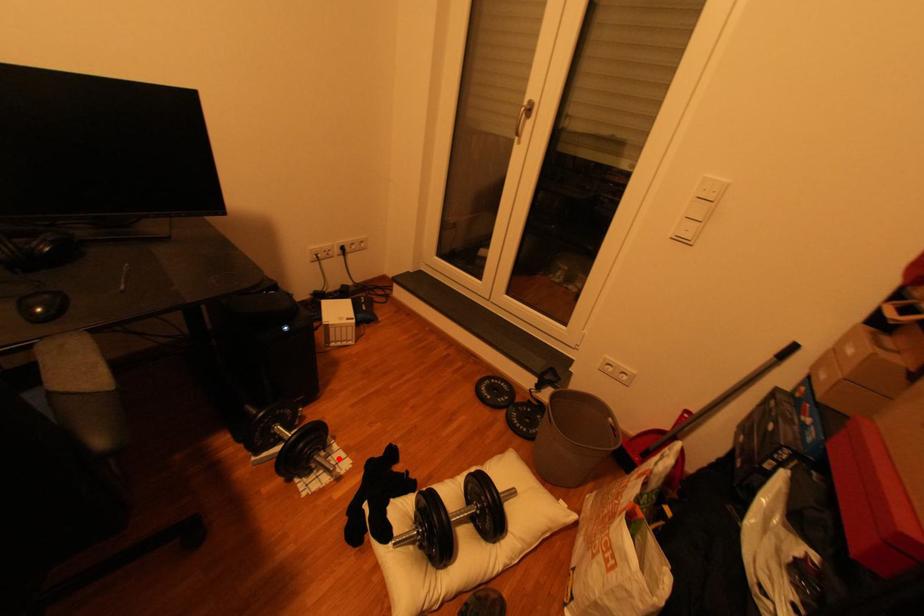
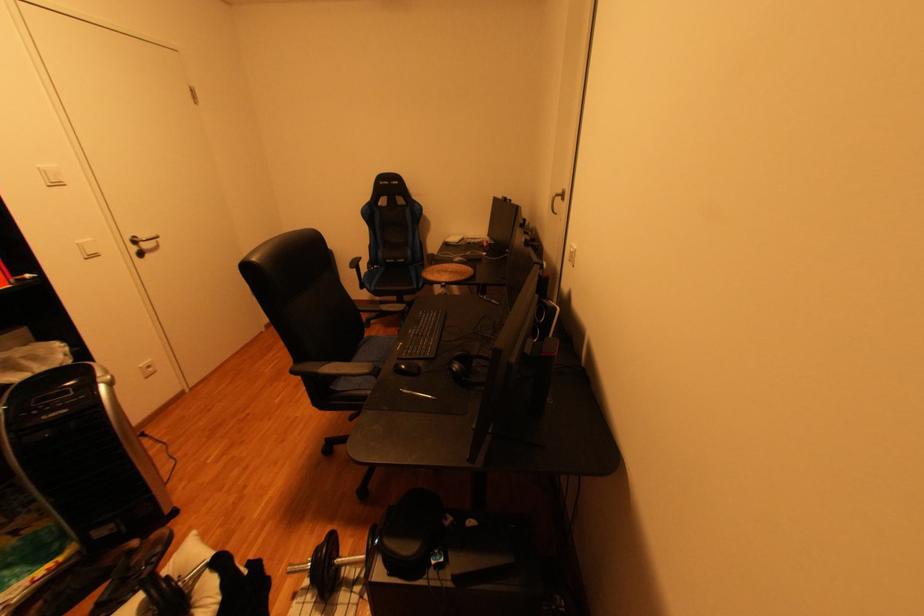
Question: A red point is marked in image1. In image2, is the corresponding 3D point closer to the camera or farther? Reply with the corresponding letter.

Choices:
 (A) The corresponding 3D point is closer.
 (B) The corresponding 3D point is farther.

Answer: (B)